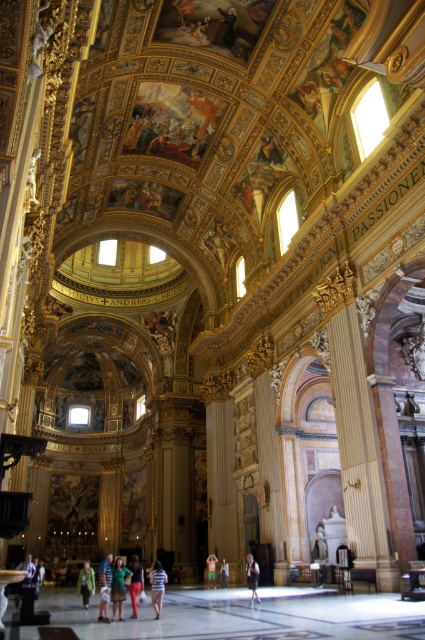
You are standing at the entrance of the church and see the green fabric dress at center. If you walk straight ahead, will you walk towards the dress or away from it?

The green fabric dress at center is located at point 0.917 on the x and 0.280 on the y axis. Since you are at the entrance, which is typically at the front of the church, walking straight ahead would take you towards the center of the image where the dress is positioned. Therefore, you would be walking towards the green fabric dress at center.

You are standing in the grand Baroque church described. You notice a point marked at coordinates (25, 576). Based on the scene description, what object is located at this point?

The point at coordinates (25, 576) corresponds to the white cotton shirt at lower left.

Looking at this image, you are standing in the grand church and see a light blue denim jacket at center and a striped fabric person at center. Which object is located to the left of the other?

The light blue denim jacket at center is positioned on the left side of striped fabric person at center.